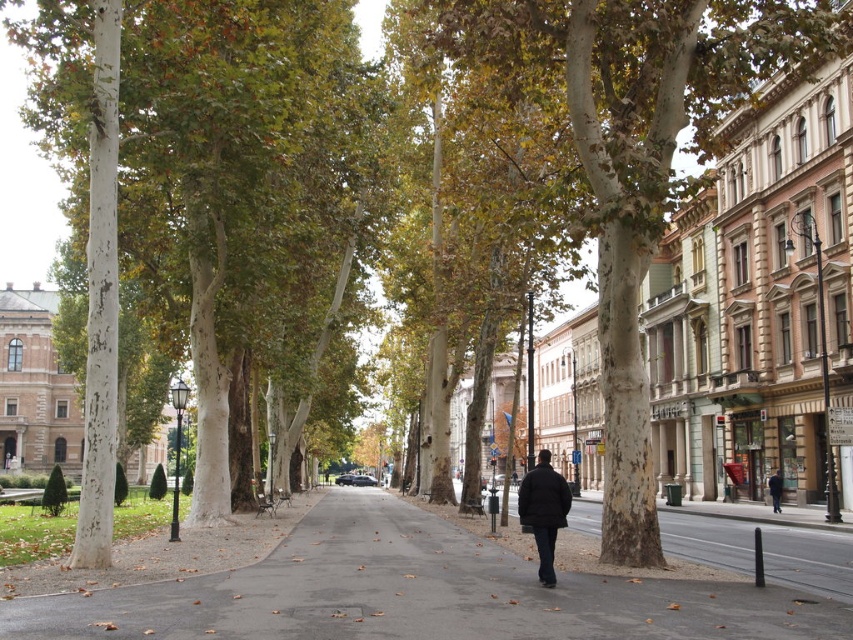
Which is more to the right, gray asphalt sidewalk at center or dark blue coat at center?

From the viewer's perspective, dark blue coat at center appears more on the right side.

Who is lower down, gray asphalt sidewalk at center or dark blue coat at center?

Positioned lower is gray asphalt sidewalk at center.

Is point (647, 625) behind point (776, 506)?

That is False.

At what (x,y) coordinates should I click in order to perform the action: click on gray asphalt sidewalk at center. Please return your answer as a coordinate pair (x, y). This screenshot has width=853, height=640. Looking at the image, I should click on (416, 593).

Does smooth bark tree at center appear over dark blue coat at center?

Indeed, smooth bark tree at center is positioned over dark blue coat at center.

The image size is (853, 640). What do you see at coordinates (624, 150) in the screenshot?
I see `smooth bark tree at center` at bounding box center [624, 150].

Who is more forward, (633, 424) or (776, 481)?

Point (633, 424)

At what (x,y) coordinates should I click in order to perform the action: click on smooth bark tree at center. Please return your answer as a coordinate pair (x, y). Looking at the image, I should click on (624, 150).

Is smooth bark tree at center thinner than black matte coat at center?

No, smooth bark tree at center is not thinner than black matte coat at center.

The image size is (853, 640). What do you see at coordinates (624, 150) in the screenshot?
I see `smooth bark tree at center` at bounding box center [624, 150].

Where is `smooth bark tree at center`? smooth bark tree at center is located at coordinates (624, 150).